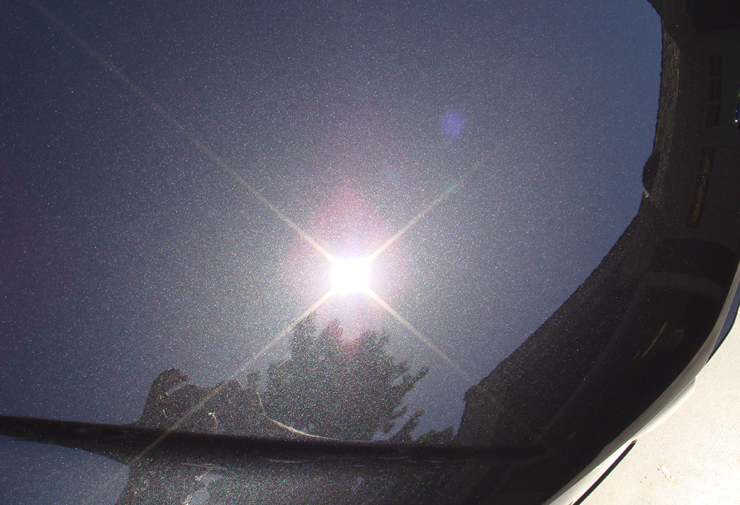
Where is `black part of mirror`? black part of mirror is located at coordinates (645, 318).